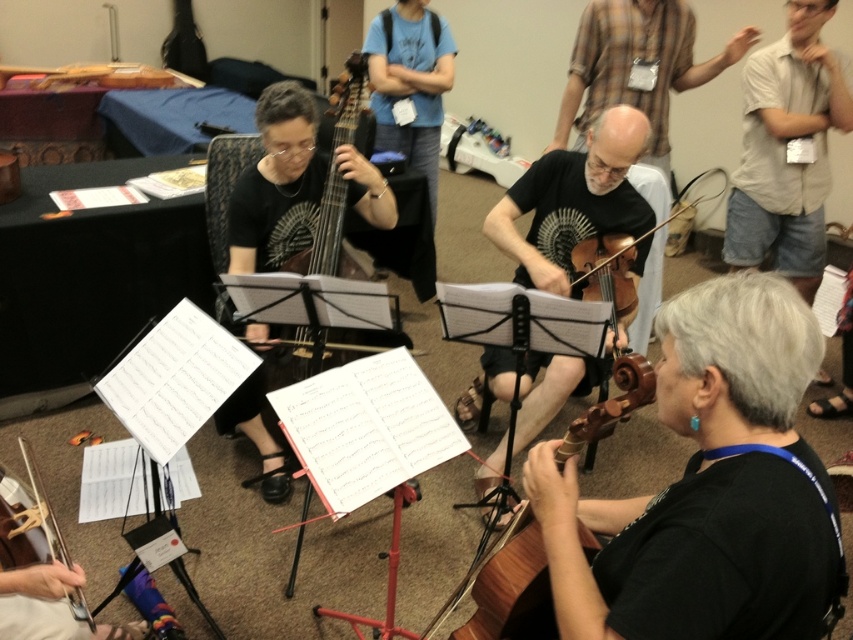
Can you confirm if brown wooden violin at center is positioned to the left of wooden polished cello at center-left?

No, brown wooden violin at center is not to the left of wooden polished cello at center-left.

Between point (498, 374) and point (265, 136), which one is positioned in front?

Point (265, 136)

Between point (576, 180) and point (314, 109), which one is positioned behind?

Positioned behind is point (576, 180).

Locate an element on the screen. The width and height of the screenshot is (853, 640). brown wooden violin at center is located at coordinates (573, 200).

Does wooden violin at lower right appear on the right side of brown wooden violin at center?

In fact, wooden violin at lower right is to the left of brown wooden violin at center.

Between point (711, 355) and point (525, 371), which one is positioned in front?

Point (711, 355)

Between point (746, 490) and point (579, 365), which one is positioned in front?

Point (746, 490)

Image resolution: width=853 pixels, height=640 pixels. Find the location of `wooden violin at lower right`. wooden violin at lower right is located at coordinates (706, 486).

Can you confirm if wooden violin at lower right is bigger than brown wooden violin at lower center?

Yes.

At what (x,y) coordinates should I click in order to perform the action: click on wooden violin at lower right. Please return your answer as a coordinate pair (x, y). Looking at the image, I should click on (706, 486).